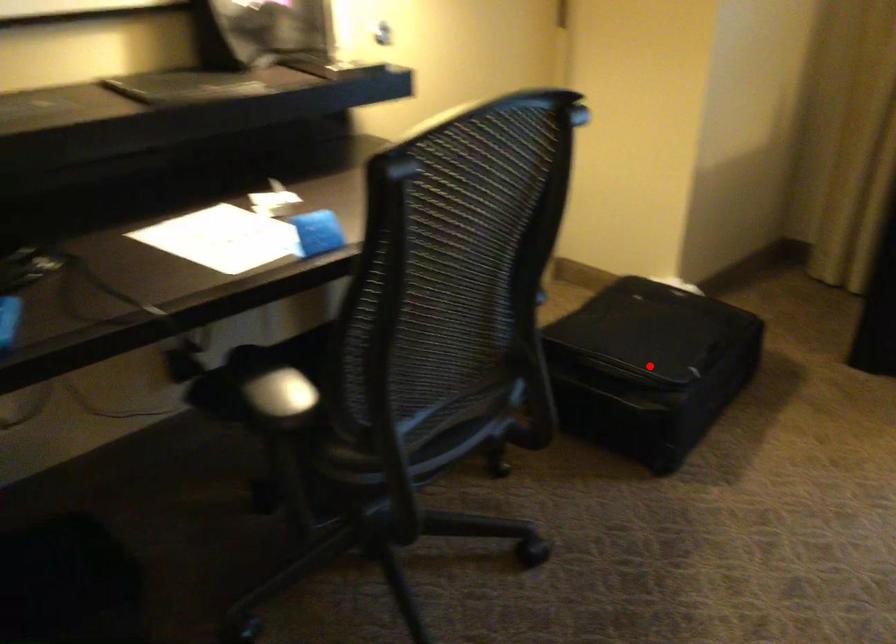
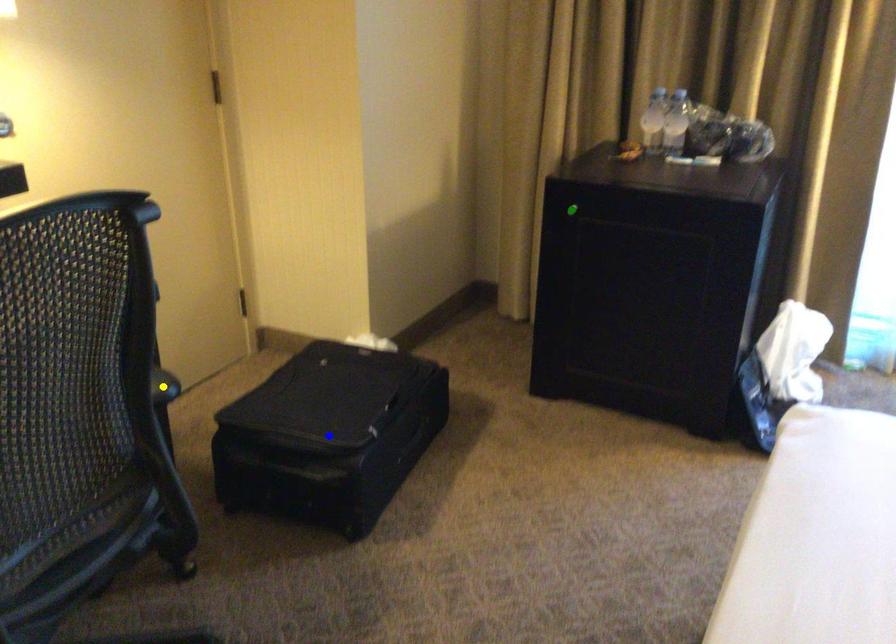
Question: I am providing you with two images of the same scene from different viewpoints. A red point is marked on the first image. You are given multiple points on the second image. Which point in image 2 represents the same 3d spot as the red point in image 1?

Choices:
 (A) yellow point
 (B) green point
 (C) blue point

Answer: (C)